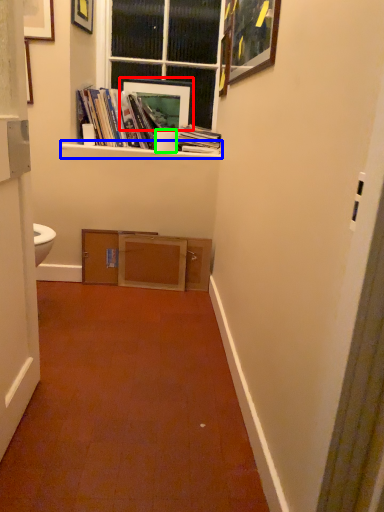
Question: Considering the real-world distances, which object is farthest from picture frame (highlighted by a red box)? window sill (highlighted by a blue box) or toilet paper (highlighted by a green box)?

Choices:
 (A) window sill
 (B) toilet paper

Answer: (A)